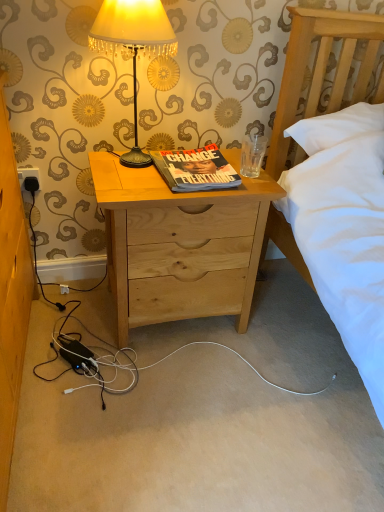
Identify the location of vacant area that lies between metallic lampshade at upper center and hardcover book at center. The image size is (384, 512). (147, 181).